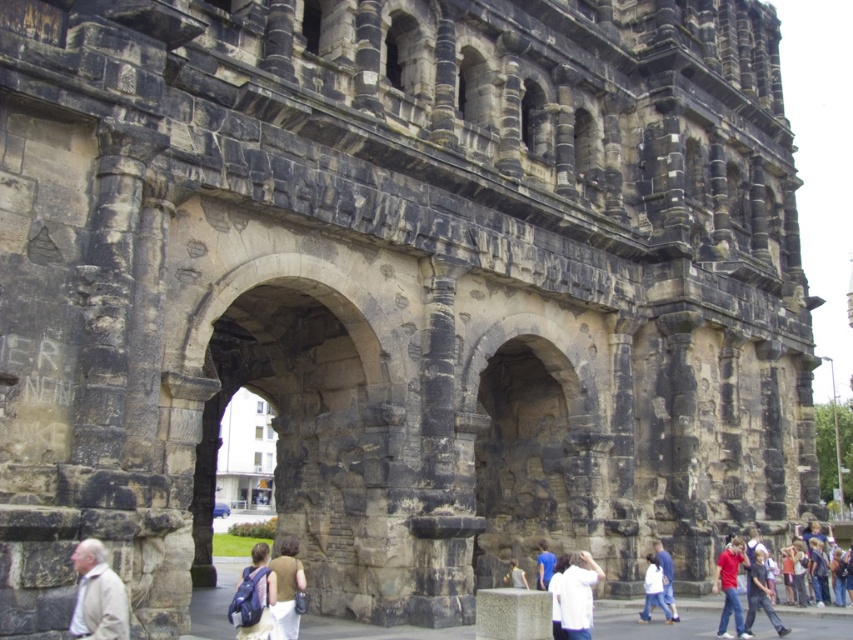
You are a tour guide leading a group near the dark gray stone archway at center. You want to ensure visitors can comfortably walk around it. Considering the distance from where you are standing to the archway, what is the minimum width of a path needed for a wheelchair to safely pass through the area near the archway?

The dark gray stone archway at center is 44.35 meters away from the camera. Since the distance is quite large, the path width requirement for wheelchair access would depend on the specific regulations, but generally, a minimum of 1.2 meters is recommended for safe passage.

You are a visitor standing at the base of the ancient stone structure. You notice the dark gray stone archway at center and the white matte shirt at lower center. Which object is located to the right of the other?

The dark gray stone archway at center is positioned on the left side of white matte shirt at lower center, so the white matte shirt at lower center is to the right of the dark gray stone archway at center.

You are standing at the base of the ancient stone structure and see a blue backpack at lower center and dark blue jeans at lower right. Which object is nearer to you?

The blue backpack at lower center is closer to the viewer than dark blue jeans at lower right.